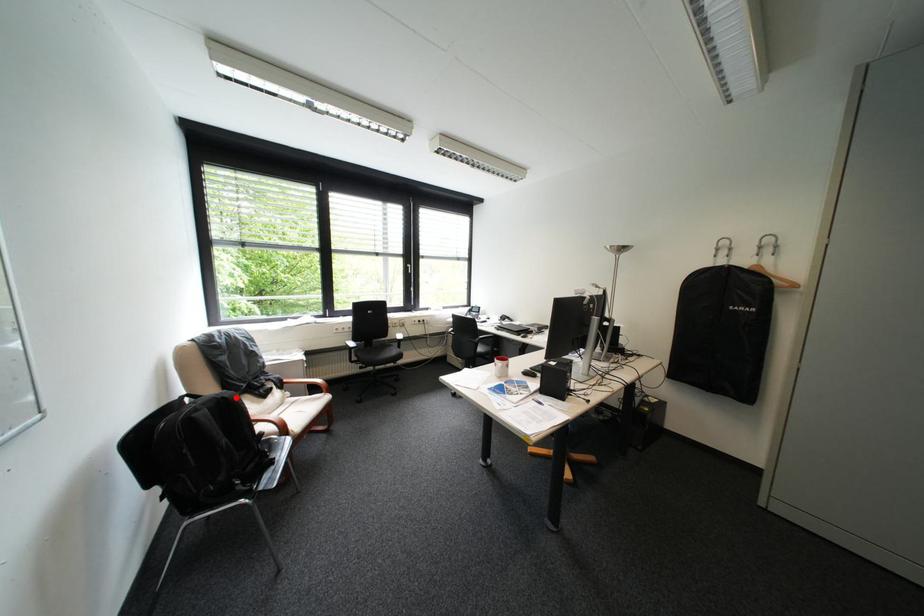
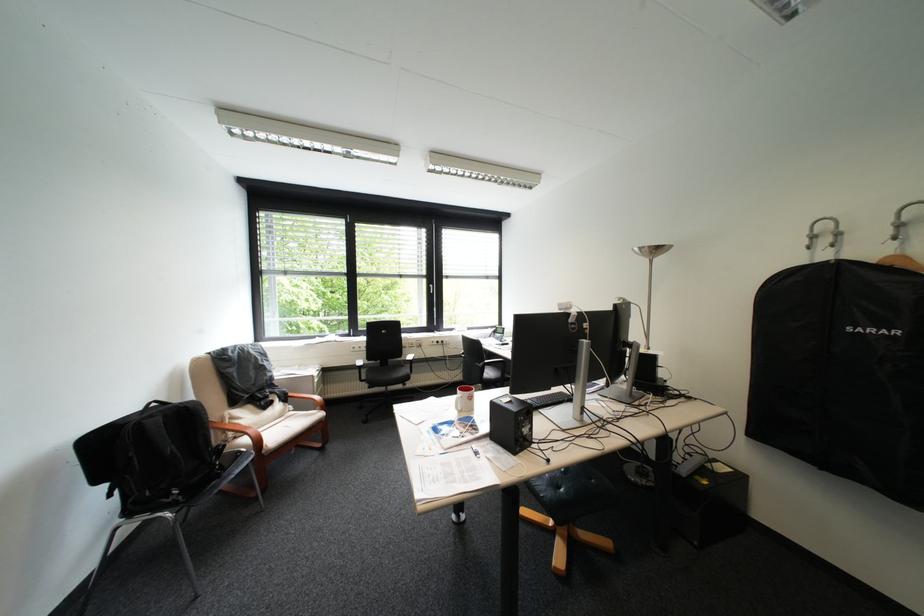
The point at the highlighted location is marked in the first image. Where is the corresponding point in the second image?

(199, 407)